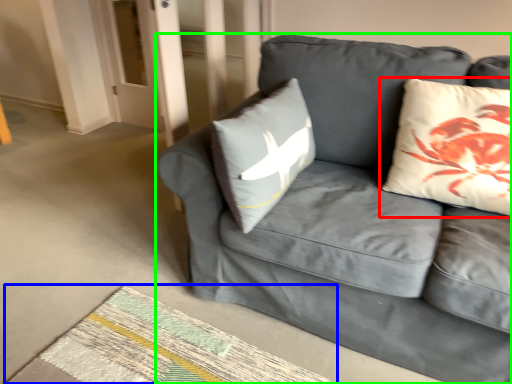
Question: Considering the real-world distances, which object is farthest from pillow (highlighted by a red box)? mat (highlighted by a blue box) or studio couch (highlighted by a green box)?

Choices:
 (A) mat
 (B) studio couch

Answer: (A)